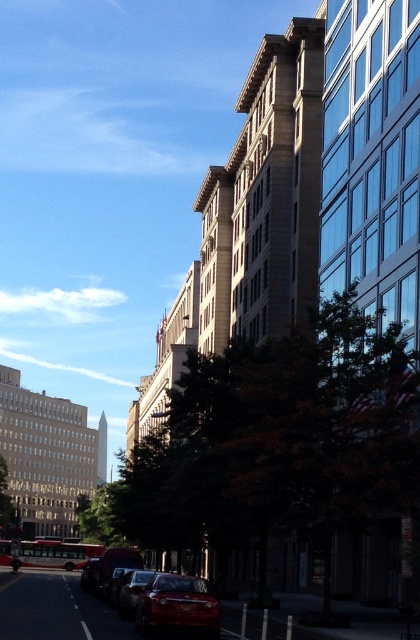
Is shiny red sedan at lower center shorter than glossy red car at lower center?

Incorrect, shiny red sedan at lower center's height does not fall short of glossy red car at lower center's.

Which is below, shiny red sedan at lower center or glossy red car at lower center?

shiny red sedan at lower center is lower down.

The image size is (420, 640). Identify the location of shiny red sedan at lower center. (154, 593).

Find the location of a particular element. The image size is (420, 640). shiny red sedan at lower center is located at coordinates click(154, 593).

Between point (181, 600) and point (88, 584), which one is positioned behind?

The point (88, 584) is more distant.

Which is behind, point (165, 598) or point (99, 557)?

Point (99, 557)

Find the location of a particular element. This screenshot has height=640, width=420. glossy red car at lower center is located at coordinates click(178, 605).

Is glossy red car at lower center smaller than shiny metallic car at lower center?

Yes.

Is point (162, 605) closer to viewer compared to point (128, 576)?

Yes, it is in front of point (128, 576).

The width and height of the screenshot is (420, 640). I want to click on glossy red car at lower center, so click(178, 605).